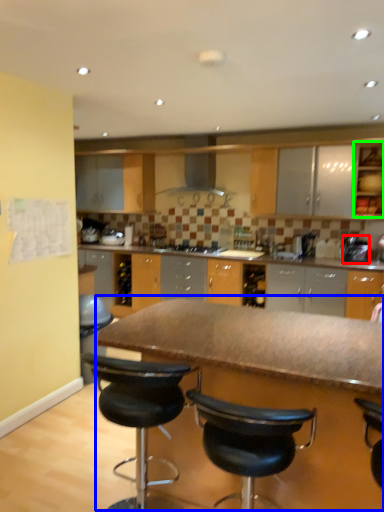
Question: Which is nearer to the appliance (highlighted by a red box)? table (highlighted by a blue box) or cabinetry (highlighted by a green box).

Choices:
 (A) table
 (B) cabinetry

Answer: (B)